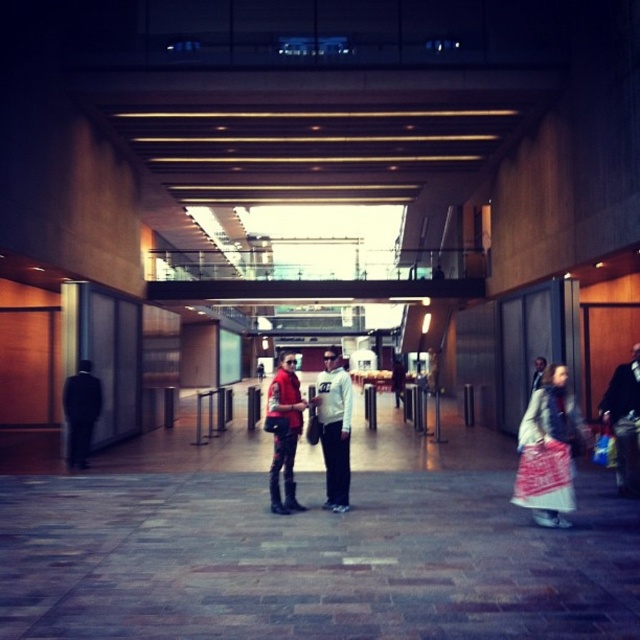
Is point (554, 410) positioned in front of point (285, 424)?

That is True.

Between white cotton dress at lower right and matte red vest at center, which one appears on the right side from the viewer's perspective?

From the viewer's perspective, white cotton dress at lower right appears more on the right side.

Which is in front, point (538, 449) or point (282, 513)?

Point (538, 449)

Find the location of `white cotton dress at lower right`. white cotton dress at lower right is located at coordinates (548, 451).

Can you confirm if matte black jacket at right is positioned to the right of dark suit at left?

Correct, you'll find matte black jacket at right to the right of dark suit at left.

Between matte black jacket at right and dark suit at left, which one appears on the left side from the viewer's perspective?

Positioned to the left is dark suit at left.

Between point (616, 392) and point (84, 426), which one is positioned in front?

Point (616, 392)

Image resolution: width=640 pixels, height=640 pixels. I want to click on matte black jacket at right, so click(x=625, y=420).

Find the location of a particular element. Image resolution: width=640 pixels, height=640 pixels. matte red vest at center is located at coordinates (284, 433).

In the scene shown: Is matte red vest at center behind matte black jacket at right?

That is False.

Does point (280, 392) come in front of point (636, 349)?

Yes, it is.

This screenshot has height=640, width=640. I want to click on matte red vest at center, so click(284, 433).